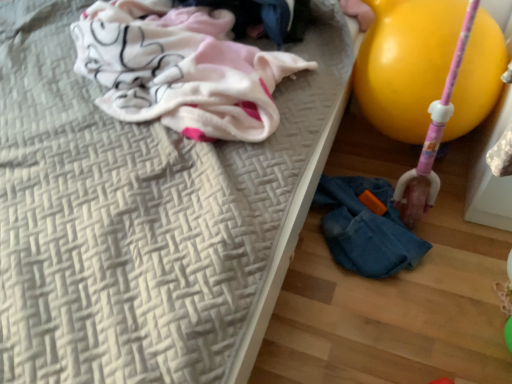
What do you see at coordinates (366, 228) in the screenshot?
I see `denim jacket at lower right` at bounding box center [366, 228].

What are the coordinates of `denim jacket at lower right` in the screenshot? It's located at (366, 228).

From the image's perspective, is yellow rubber balloon at right beneath denim jacket at lower right?

No, from the image's perspective, yellow rubber balloon at right is not below denim jacket at lower right.

Looking at the image, does yellow rubber balloon at right seem bigger or smaller compared to denim jacket at lower right?

Clearly, yellow rubber balloon at right is larger in size than denim jacket at lower right.

Is yellow rubber balloon at right in front of denim jacket at lower right?

That is True.

Which is more to the right, yellow rubber balloon at right or denim jacket at lower right?

yellow rubber balloon at right.

Is white cotton cloth at upper left surrounded by denim jacket at lower right?

→ That's incorrect, white cotton cloth at upper left is not inside denim jacket at lower right.

From a real-world perspective, is denim jacket at lower right beneath white cotton cloth at upper left?

Yes.

Is point (336, 211) positioned after point (106, 39)?

Yes, it is behind point (106, 39).

Between denim jacket at lower right and white cotton cloth at upper left, which one has more height?

white cotton cloth at upper left.

How many degrees apart are the facing directions of white woven mattress at upper left and yellow rubber balloon at right?

The facing directions of white woven mattress at upper left and yellow rubber balloon at right are 91.1 degrees apart.

The height and width of the screenshot is (384, 512). I want to click on bed in front of the yellow rubber balloon at right, so click(x=145, y=215).

From the image's perspective, which is below, white woven mattress at upper left or yellow rubber balloon at right?

white woven mattress at upper left is shown below in the image.

Between white woven mattress at upper left and white cotton cloth at upper left, which one has less height?

A: white cotton cloth at upper left is shorter.

From the image's perspective, which one is positioned higher, white woven mattress at upper left or white cotton cloth at upper left?

white cotton cloth at upper left appears higher in the image.

Based on their positions, is white woven mattress at upper left located to the left or right of white cotton cloth at upper left?

From the image, it's evident that white woven mattress at upper left is to the left of white cotton cloth at upper left.

From the image's perspective, is white cotton cloth at upper left located above white woven mattress at upper left?

Yes, from the image's perspective, white cotton cloth at upper left is over white woven mattress at upper left.

How far apart are white cotton cloth at upper left and white woven mattress at upper left?

white cotton cloth at upper left is 6.07 inches from white woven mattress at upper left.

Considering the sizes of objects white cotton cloth at upper left and white woven mattress at upper left in the image provided, who is taller, white cotton cloth at upper left or white woven mattress at upper left?

white woven mattress at upper left.

Which point is more distant from viewer, (115, 68) or (42, 138)?

The point (115, 68) is behind.

Can you confirm if white woven mattress at upper left is thinner than denim jacket at lower right?

In fact, white woven mattress at upper left might be wider than denim jacket at lower right.

The width and height of the screenshot is (512, 384). I want to click on woman that is on the right side of white woven mattress at upper left, so click(366, 228).

Does white woven mattress at upper left lie behind denim jacket at lower right?

That is False.

How much distance is there between white woven mattress at upper left and denim jacket at lower right?

white woven mattress at upper left and denim jacket at lower right are 17.80 inches apart.

Consider the image. Do you think yellow rubber balloon at right is within white woven mattress at upper left, or outside of it?

yellow rubber balloon at right is outside white woven mattress at upper left.

From their relative heights in the image, would you say yellow rubber balloon at right is taller or shorter than white woven mattress at upper left?

Considering their sizes, yellow rubber balloon at right has less height than white woven mattress at upper left.

Is yellow rubber balloon at right next to white woven mattress at upper left?

No, yellow rubber balloon at right is not making contact with white woven mattress at upper left.

Measure the distance between yellow rubber balloon at right and white woven mattress at upper left.

39.42 centimeters.

The height and width of the screenshot is (384, 512). I want to click on woman directly beneath the yellow rubber balloon at right (from a real-world perspective), so click(366, 228).

Identify the location of clothing in front of the denim jacket at lower right. This screenshot has height=384, width=512. (181, 70).

Based on their spatial positions, is white woven mattress at upper left or yellow rubber balloon at right closer to white cotton cloth at upper left?

white woven mattress at upper left is closer to white cotton cloth at upper left.

Estimate the real-world distances between objects in this image. Which object is further from denim jacket at lower right, white woven mattress at upper left or yellow rubber balloon at right?

white woven mattress at upper left lies further to denim jacket at lower right than the other object.

In the scene shown: From the image, which object appears to be nearer to white woven mattress at upper left, denim jacket at lower right or white cotton cloth at upper left?

Based on the image, white cotton cloth at upper left appears to be nearer to white woven mattress at upper left.

Looking at the image, which one is located closer to white woven mattress at upper left, denim jacket at lower right or yellow rubber balloon at right?

yellow rubber balloon at right is closer to white woven mattress at upper left.

When comparing their distances from denim jacket at lower right, does yellow rubber balloon at right or white woven mattress at upper left seem closer?

The object closer to denim jacket at lower right is yellow rubber balloon at right.

Estimate the real-world distances between objects in this image. Which object is closer to denim jacket at lower right, white cotton cloth at upper left or yellow rubber balloon at right?

yellow rubber balloon at right is positioned closer to the anchor denim jacket at lower right.

From the picture: Which object lies further to the anchor point denim jacket at lower right, white woven mattress at upper left or white cotton cloth at upper left?

The object further to denim jacket at lower right is white cotton cloth at upper left.

When comparing their distances from white cotton cloth at upper left, does yellow rubber balloon at right or white woven mattress at upper left seem further?

Result: yellow rubber balloon at right.

Where is `woman between white woven mattress at upper left and yellow rubber balloon at right in the horizontal direction`? This screenshot has height=384, width=512. woman between white woven mattress at upper left and yellow rubber balloon at right in the horizontal direction is located at coordinates (366, 228).

Identify the location of clothing between white woven mattress at upper left and denim jacket at lower right in the horizontal direction. (181, 70).

Where is `woman between white cotton cloth at upper left and yellow rubber balloon at right`? The image size is (512, 384). woman between white cotton cloth at upper left and yellow rubber balloon at right is located at coordinates (366, 228).

Image resolution: width=512 pixels, height=384 pixels. I want to click on clothing situated between white woven mattress at upper left and yellow rubber balloon at right from left to right, so click(x=181, y=70).